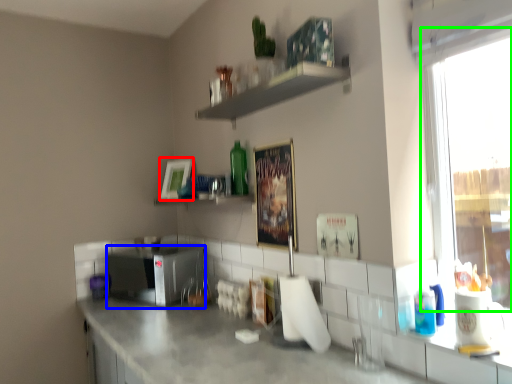
Question: Estimate the real-world distances between objects in this image. Which object is farther from picture frame (highlighted by a red box), appliance (highlighted by a blue box) or window (highlighted by a green box)?

Choices:
 (A) appliance
 (B) window

Answer: (B)